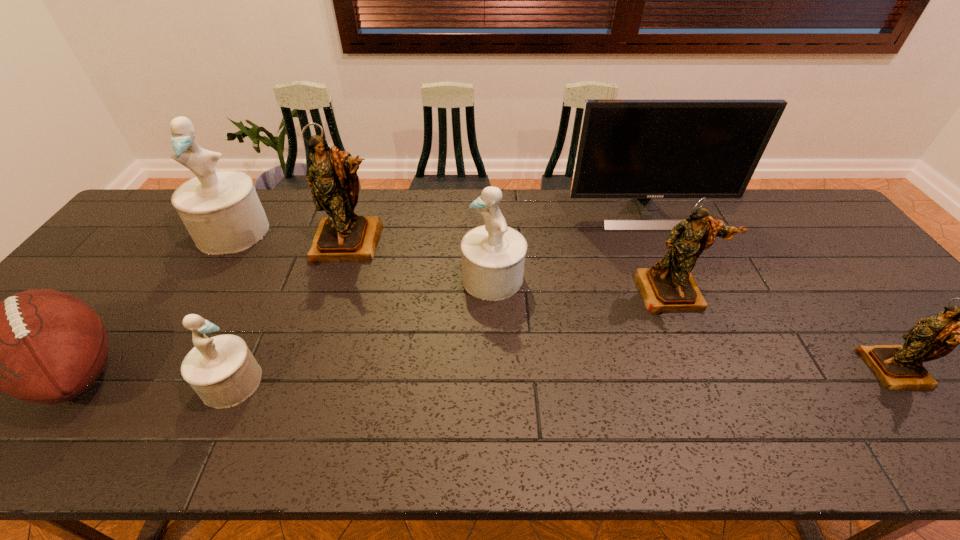
The image size is (960, 540). Find the location of `the second closest white figurine to the nearest white figurine`. the second closest white figurine to the nearest white figurine is located at coordinates (492, 255).

Identify the location of white figurine that stands as the closest to the biggest white figurine. (223, 372).

Identify which gold figurine is located as the second nearest to the nearest gold figurine. Please provide its 2D coordinates. Your answer should be formatted as a tuple, i.e. [(x, y)], where the tuple contains the x and y coordinates of a point satisfying the conditions above.

[(343, 236)]

Identify the location of the closest gold figurine to the second gold figurine from left to right. The image size is (960, 540). (898, 367).

Locate an element on the screen. vacant region that satisfies the following two spatial constraints: 1. on the screen side of the monitor; 2. at the beak of the second white figurine from left to right is located at coordinates (722, 382).

The height and width of the screenshot is (540, 960). In order to click on vacant space that satisfies the following two spatial constraints: 1. on the front-facing side of the biggest gold figurine; 2. at the beak of the smallest white figurine in this screenshot , I will do `click(304, 382)`.